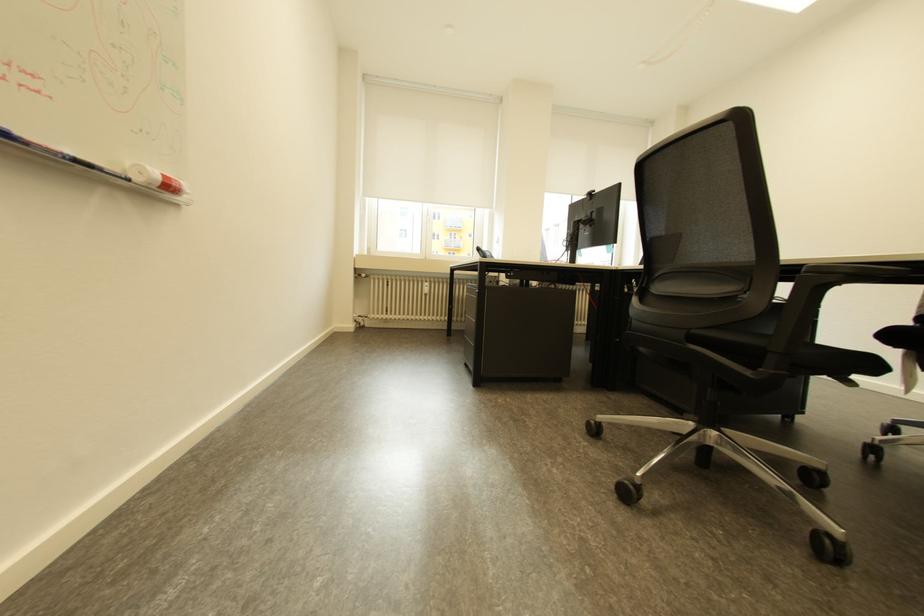
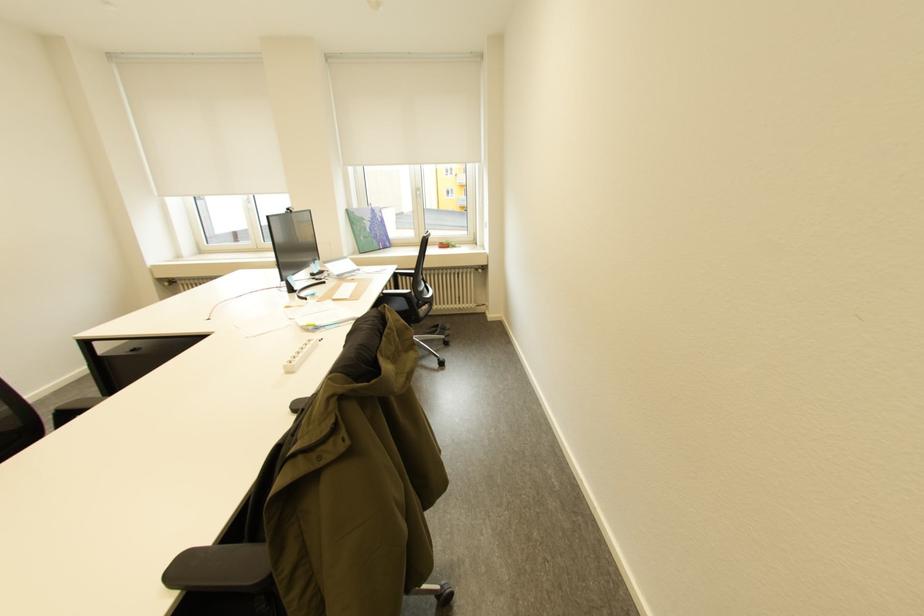
Question: What movement of the cameraman would produce the second image?

Choices:
 (A) Left
 (B) Right
 (C) Forward
 (D) Backward

Answer: (B)